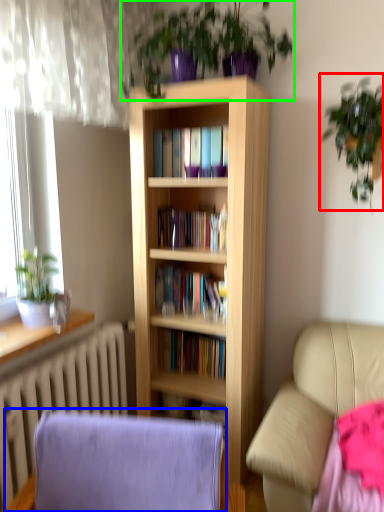
Question: Which object is the closest to the houseplant (highlighted by a red box)? Choose among these: rocking chair (highlighted by a blue box) or houseplant (highlighted by a green box).

Choices:
 (A) rocking chair
 (B) houseplant

Answer: (B)